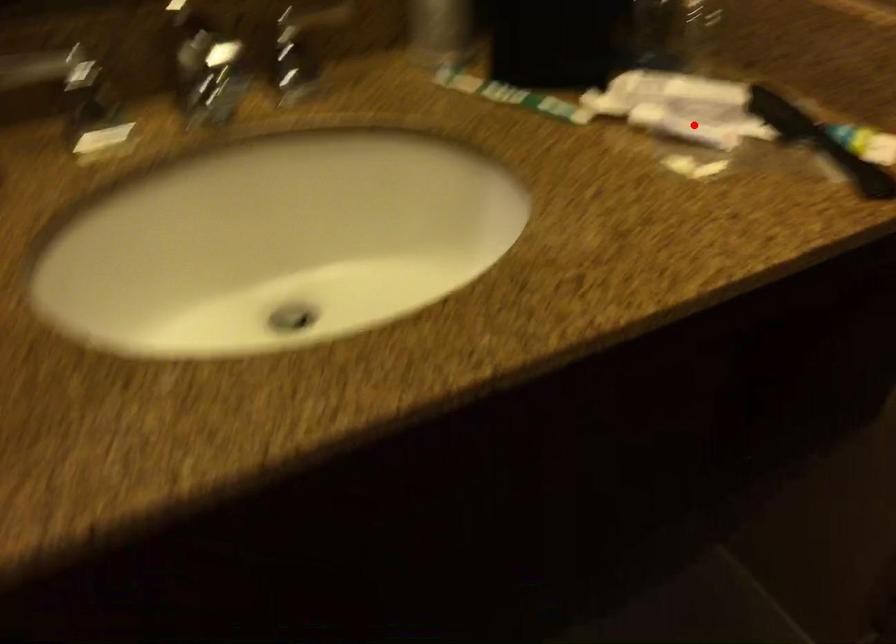
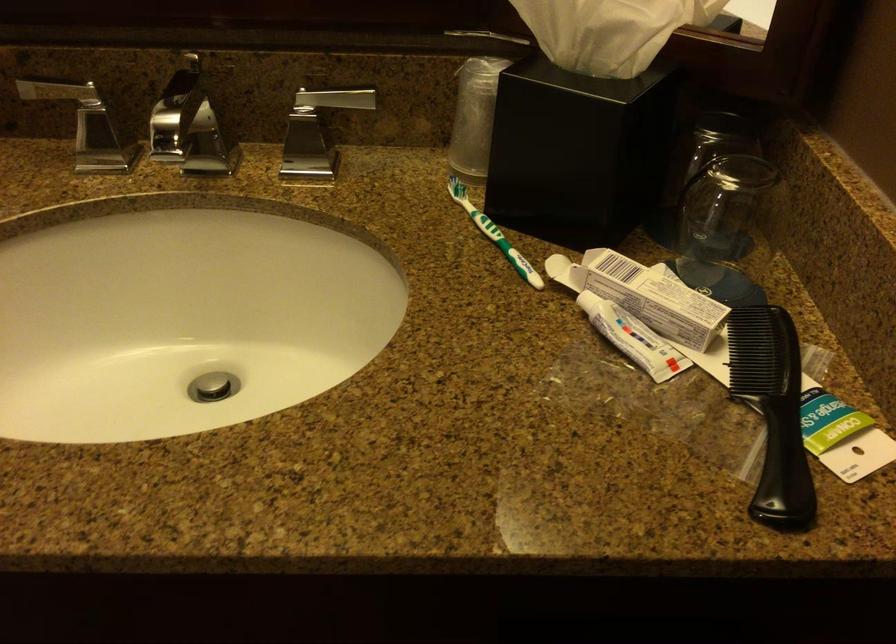
Question: A red point is marked in image1. In image2, is the corresponding 3D point closer to the camera or farther? Reply with the corresponding letter.

Choices:
 (A) The corresponding 3D point is closer.
 (B) The corresponding 3D point is farther.

Answer: (A)